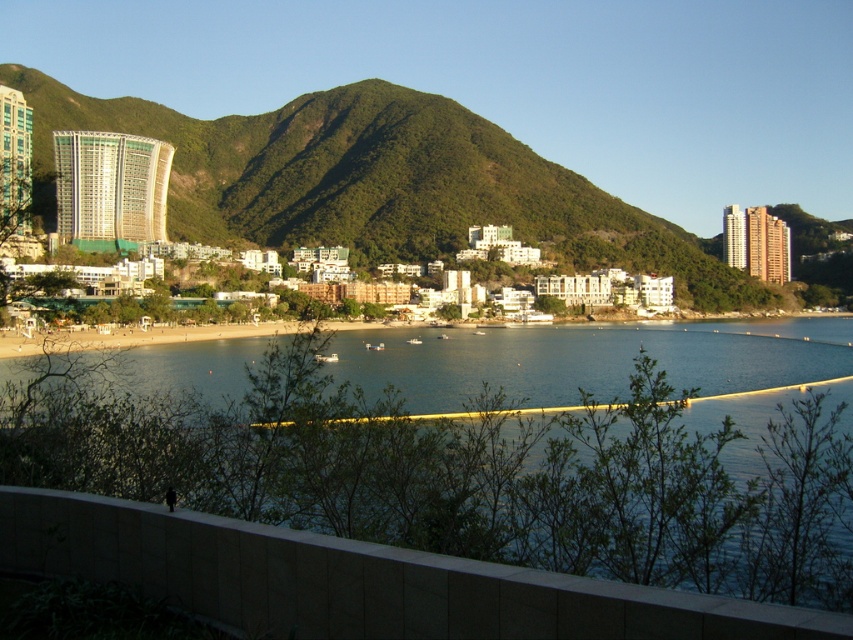
Can you confirm if clear blue water at center is bigger than green textured mountain at center?

No, clear blue water at center is not bigger than green textured mountain at center.

Which of these two, clear blue water at center or green textured mountain at center, stands shorter?

clear blue water at center

What do you see at coordinates (465, 470) in the screenshot? The height and width of the screenshot is (640, 853). I see `clear blue water at center` at bounding box center [465, 470].

Locate an element on the screen. clear blue water at center is located at coordinates (465, 470).